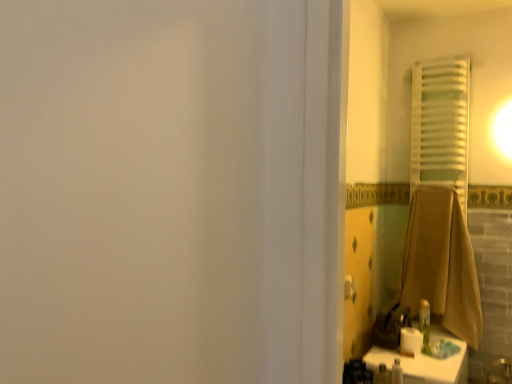
Question: Is white fabric towel at right inside the boundaries of brown cotton towel at right, or outside?

Choices:
 (A) inside
 (B) outside

Answer: (B)

Question: Does point (437, 94) appear closer or farther from the camera than point (474, 306)?

Choices:
 (A) closer
 (B) farther

Answer: (B)

Question: Which of these objects is positioned closest to the brown cotton towel at right?

Choices:
 (A) white glossy counter top at lower right
 (B) white matte toilet paper at lower right
 (C) white fabric towel at right

Answer: (A)

Question: Which object is the closest to the white matte toilet paper at lower right?

Choices:
 (A) brown cotton towel at right
 (B) white fabric towel at right
 (C) white glossy counter top at lower right

Answer: (C)